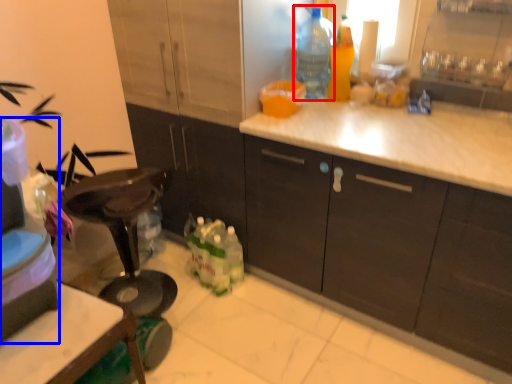
Question: Which of the following is the closest to the observer, bottle (highlighted by a red box) or appliance (highlighted by a blue box)?

Choices:
 (A) bottle
 (B) appliance

Answer: (B)